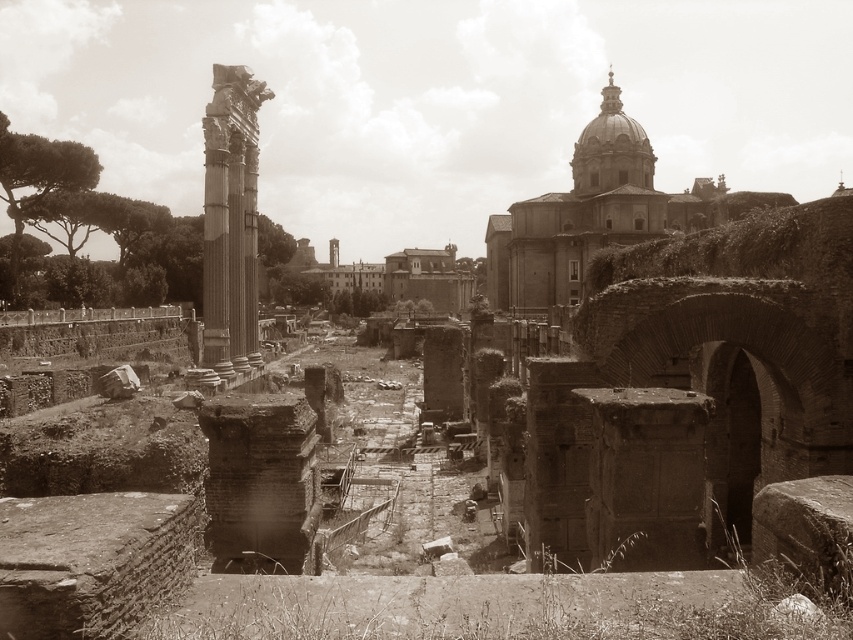
Is smooth stone dome at upper right bigger than smooth stone column at left?

Yes.

Can you confirm if smooth stone dome at upper right is shorter than smooth stone column at left?

In fact, smooth stone dome at upper right may be taller than smooth stone column at left.

Does point (618, 122) come farther from viewer compared to point (204, 340)?

Yes, it is behind point (204, 340).

The height and width of the screenshot is (640, 853). I want to click on smooth stone dome at upper right, so pos(595,214).